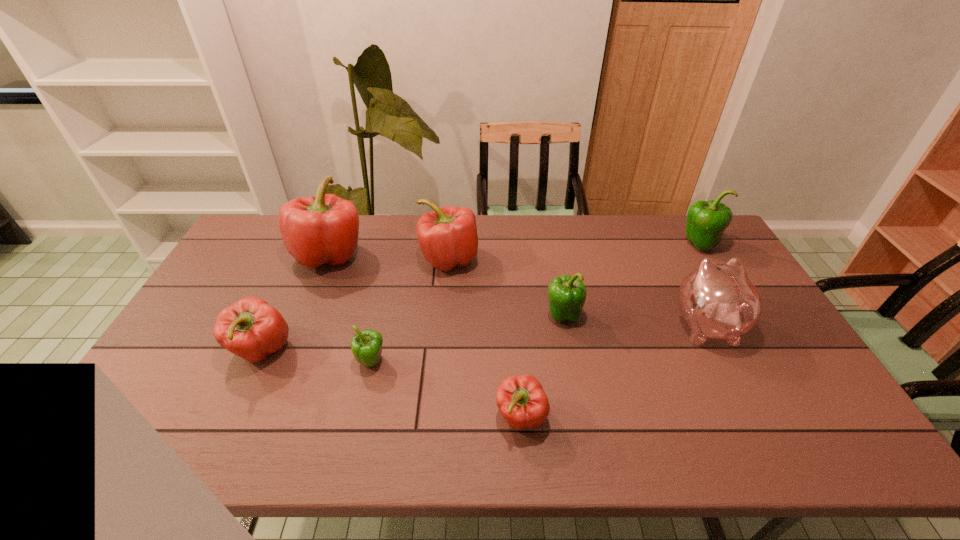
Image resolution: width=960 pixels, height=540 pixels. I want to click on vacant area between the second green bell pepper from right to left and the rightmost green bell pepper, so click(x=631, y=280).

At what (x,y) coordinates should I click in order to perform the action: click on vacant region between the second green bell pepper from right to left and the leftmost green bell pepper. Please return your answer as a coordinate pair (x, y). The height and width of the screenshot is (540, 960). Looking at the image, I should click on (467, 339).

Select which object is the sixth closest to the third biggest pink bell pepper. Please provide its 2D coordinates. Your answer should be formatted as a tuple, i.e. [(x, y)], where the tuple contains the x and y coordinates of a point satisfying the conditions above.

[(718, 301)]

Find the location of a particular element. object that is the sixth closest to the biggest pink bell pepper is located at coordinates (718, 301).

Locate an element on the screen. The image size is (960, 540). bell pepper that stands as the fifth closest to the biggest pink bell pepper is located at coordinates (521, 400).

Locate which bell pepper ranks fourth in proximity to the third bell pepper from right to left. Please provide its 2D coordinates. Your answer should be formatted as a tuple, i.e. [(x, y)], where the tuple contains the x and y coordinates of a point satisfying the conditions above.

[(250, 328)]

Locate which pink bell pepper ranks in proximity to the second farthest green bell pepper. Please provide its 2D coordinates. Your answer should be formatted as a tuple, i.e. [(x, y)], where the tuple contains the x and y coordinates of a point satisfying the conditions above.

[(447, 237)]

Identify which pink bell pepper is located as the second nearest to the second nearest pink bell pepper. Please provide its 2D coordinates. Your answer should be formatted as a tuple, i.e. [(x, y)], where the tuple contains the x and y coordinates of a point satisfying the conditions above.

[(447, 237)]

Select which green bell pepper is the closest to the fourth bell pepper from left to right. Please provide its 2D coordinates. Your answer should be formatted as a tuple, i.e. [(x, y)], where the tuple contains the x and y coordinates of a point satisfying the conditions above.

[(567, 294)]

The width and height of the screenshot is (960, 540). In order to click on the second closest green bell pepper to the second bell pepper from right to left in this screenshot , I will do `click(706, 221)`.